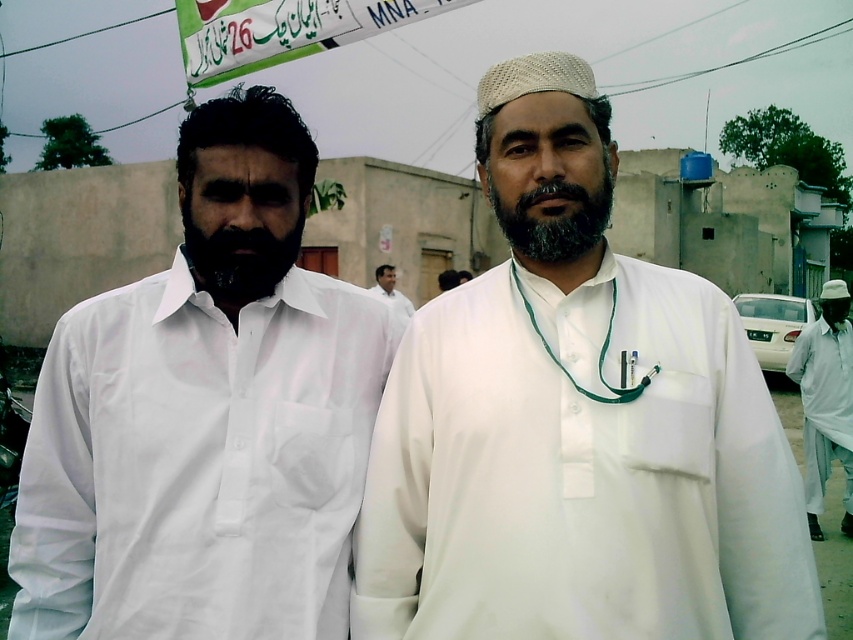
Question: Estimate the real-world distances between objects in this image. Which object is farther from the white cotton robe at right?

Choices:
 (A) white cotton shirt at center
 (B) gray matte beard at center

Answer: (B)

Question: Is black matte beard at center bigger than white cotton shirt at center?

Choices:
 (A) yes
 (B) no

Answer: (B)

Question: Does white cotton robe at right appear on the left side of white matte neck at center?

Choices:
 (A) yes
 (B) no

Answer: (B)

Question: Which point is farther to the camera?

Choices:
 (A) pyautogui.click(x=386, y=269)
 (B) pyautogui.click(x=576, y=228)

Answer: (A)

Question: Does black matte beard at center appear on the left side of white cotton shirt at center?

Choices:
 (A) no
 (B) yes

Answer: (B)

Question: Which point appears closest to the camera in this image?

Choices:
 (A) click(538, 260)
 (B) click(808, 428)

Answer: (A)